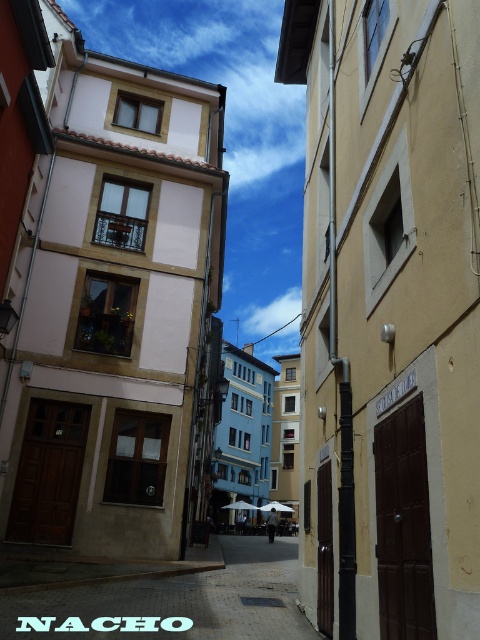
Can you confirm if beige matte door at center right is positioned below smooth stone alley at center?

Incorrect, beige matte door at center right is not positioned below smooth stone alley at center.

The width and height of the screenshot is (480, 640). Describe the element at coordinates (388, 316) in the screenshot. I see `beige matte door at center right` at that location.

What do you see at coordinates (388, 316) in the screenshot? The height and width of the screenshot is (640, 480). I see `beige matte door at center right` at bounding box center [388, 316].

Where is `beige matte door at center right`? This screenshot has height=640, width=480. beige matte door at center right is located at coordinates 388,316.